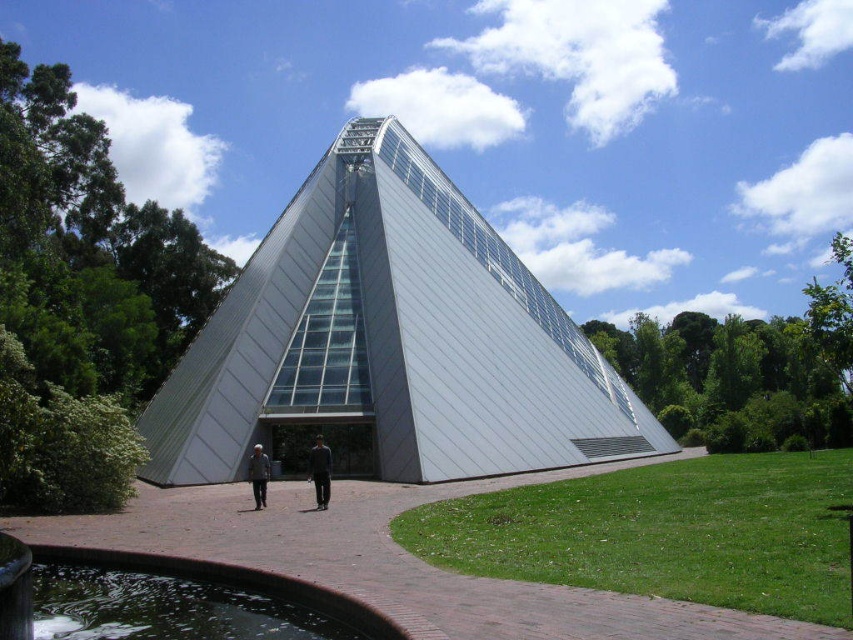
Question: Which point is farther from the camera taking this photo?

Choices:
 (A) (309, 465)
 (B) (479, 262)
 (C) (273, 525)
 (D) (258, 451)

Answer: (B)

Question: Is brick path at center to the right of gray fabric jacket at center from the viewer's perspective?

Choices:
 (A) yes
 (B) no

Answer: (A)

Question: Which point is closer to the camera?

Choices:
 (A) (259, 477)
 (B) (592, 408)
 (C) (49, 518)

Answer: (C)

Question: Considering the relative positions of brick path at center and dark gray suit at center in the image provided, where is brick path at center located with respect to dark gray suit at center?

Choices:
 (A) left
 (B) right

Answer: (B)

Question: Which is farther from the dark gray suit at center?

Choices:
 (A) white glass pyramid at center
 (B) brick path at center

Answer: (A)

Question: Where is white glass pyramid at center located in relation to gray fabric jacket at center in the image?

Choices:
 (A) right
 (B) left

Answer: (A)